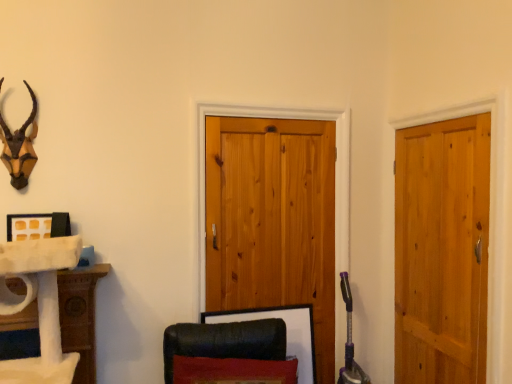
Question: In terms of size, does wooden picture frame at lower center appear bigger or smaller than natural wood barn door at center?

Choices:
 (A) big
 (B) small

Answer: (B)

Question: Is wooden picture frame at lower center situated inside natural wood barn door at center or outside?

Choices:
 (A) outside
 (B) inside

Answer: (B)

Question: Estimate the real-world distances between objects in this image. Which object is farther from the natural wood barn door at center?

Choices:
 (A) wooden picture frame at lower center
 (B) light brown wooden door at right

Answer: (B)

Question: Which is nearer to the light brown wooden door at right?

Choices:
 (A) natural wood barn door at center
 (B) wooden picture frame at lower center

Answer: (A)